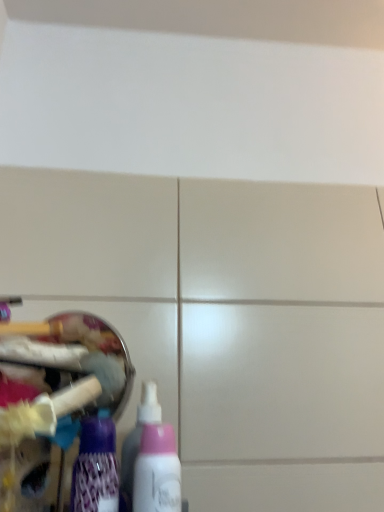
Question: Considering the positions of pink plastic bottle at lower left, the 1th bottle viewed from the right, and purple glossy bottle at lower left, the third bottle positioned from the right, in the image, is pink plastic bottle at lower left, the 1th bottle viewed from the right, wider or thinner than purple glossy bottle at lower left, the third bottle positioned from the right,?

Choices:
 (A) wide
 (B) thin

Answer: (B)

Question: From the image's perspective, is pink plastic bottle at lower left, the 1th bottle viewed from the right, above or below purple glossy bottle at lower left, positioned as the 1th bottle in left-to-right order?

Choices:
 (A) below
 (B) above

Answer: (A)

Question: Which object is positioned farthest from the purple glossy bottle at lower left, the third bottle positioned from the right?

Choices:
 (A) pink plastic bottle at lower left, which ranks as the 3th bottle in left-to-right order
 (B) pink matte bottle at lower left, placed as the second bottle when sorted from right to left

Answer: (B)

Question: Which is nearer to the purple glossy bottle at lower left, positioned as the 1th bottle in left-to-right order?

Choices:
 (A) pink matte bottle at lower left, placed as the second bottle when sorted from right to left
 (B) pink plastic bottle at lower left, which ranks as the 3th bottle in left-to-right order

Answer: (B)